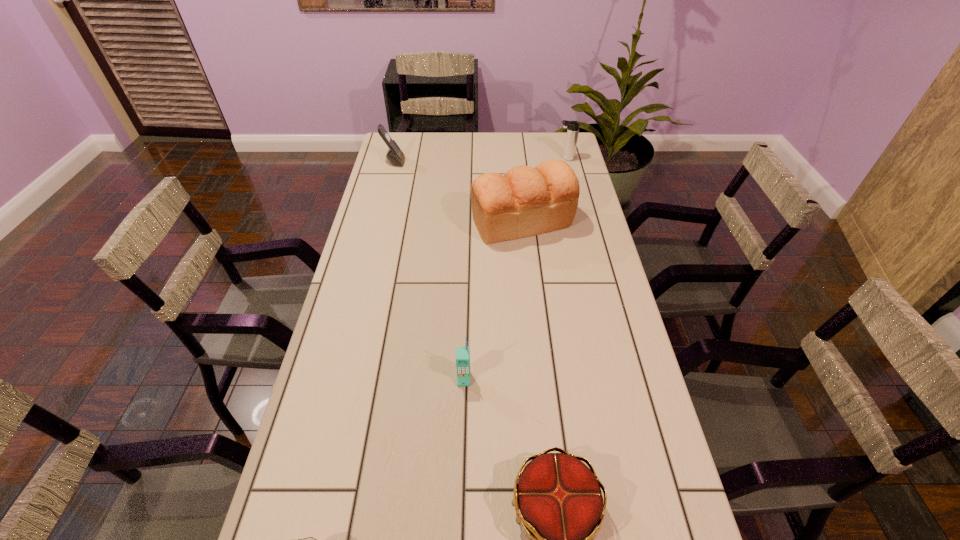
Locate an element on the screen. bread is located at coordinates (526, 201).

The width and height of the screenshot is (960, 540). Identify the location of the tallest object. (526, 201).

Identify the location of thermos bottle. (573, 126).

I want to click on the farther cellular telephone, so click(x=394, y=155).

I want to click on the third nearest object, so click(462, 353).

The width and height of the screenshot is (960, 540). What are the coordinates of `the right cellular telephone` in the screenshot? It's located at (462, 353).

What are the coordinates of `vacant space located on the front of the third farthest object` in the screenshot? It's located at (525, 259).

Locate an element on the screen. blank space located 0.390m on the handle side of the thermos bottle is located at coordinates (463, 158).

Find the location of a particular element. The width and height of the screenshot is (960, 540). vacant region located 0.190m on the handle side of the thermos bottle is located at coordinates (512, 158).

Image resolution: width=960 pixels, height=540 pixels. Find the location of `free space located on the handle side of the thermos bottle`. free space located on the handle side of the thermos bottle is located at coordinates (468, 158).